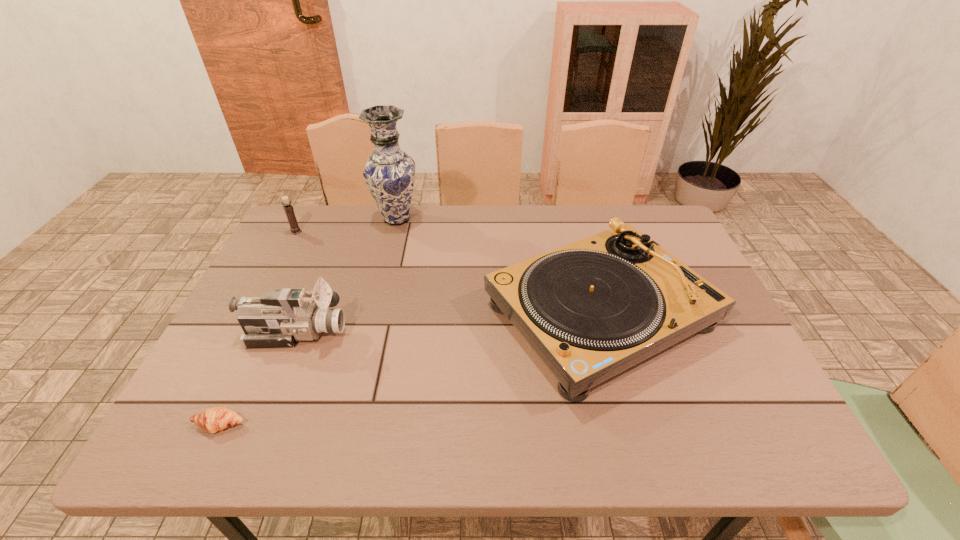
The image size is (960, 540). What are the coordinates of `unoccupied position between the tallest object and the camcorder` in the screenshot? It's located at (347, 275).

Find the location of a particular element. Image resolution: width=960 pixels, height=540 pixels. free space between the camcorder and the record player is located at coordinates (448, 323).

In order to click on free spot between the tallest object and the camcorder in this screenshot , I will do `click(347, 275)`.

The height and width of the screenshot is (540, 960). Find the location of `vacant space in between the nearest object and the camcorder`. vacant space in between the nearest object and the camcorder is located at coordinates (258, 379).

Select which object appears as the second closest to the record player. Please provide its 2D coordinates. Your answer should be formatted as a tuple, i.e. [(x, y)], where the tuple contains the x and y coordinates of a point satisfying the conditions above.

[(279, 318)]

Choose which object is the third nearest neighbor to the candle holder. Please provide its 2D coordinates. Your answer should be formatted as a tuple, i.e. [(x, y)], where the tuple contains the x and y coordinates of a point satisfying the conditions above.

[(591, 309)]

In order to click on vacant space that satisfies the following two spatial constraints: 1. on the front side of the rightmost object; 2. on the left side of the candle holder in this screenshot , I will do `click(253, 314)`.

Locate an element on the screen. The width and height of the screenshot is (960, 540). free space in the image that satisfies the following two spatial constraints: 1. on the front side of the record player; 2. on the right side of the tallest object is located at coordinates (373, 314).